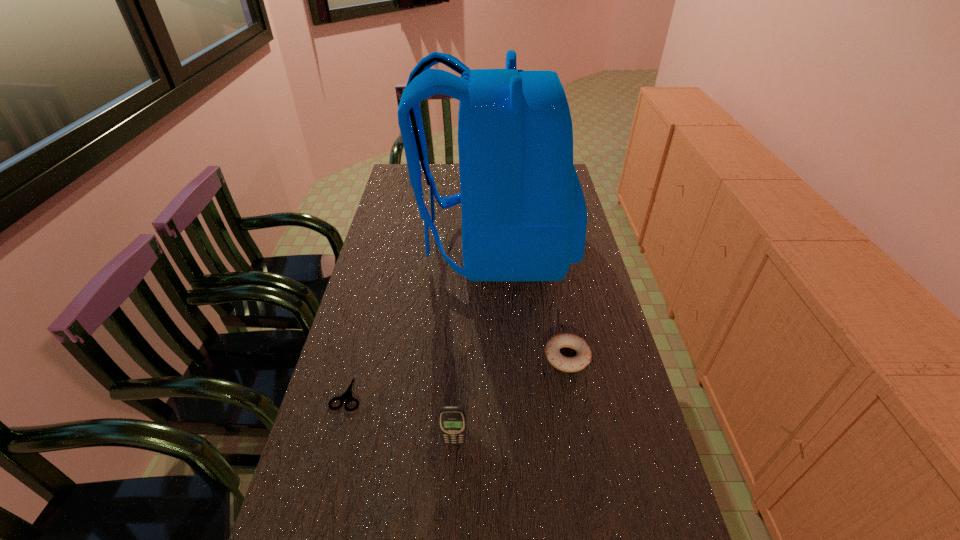
You are a GUI agent. You are given a task and a screenshot of the screen. Output one action in this format:
    pyautogui.click(x=<x>, y=<y>)
    Task: Click on the vacant area that lies between the tallest object and the third tallest object
    This screenshot has height=540, width=960.
    Given the screenshot: What is the action you would take?
    pyautogui.click(x=531, y=302)

Locate an element on the screen. This screenshot has height=540, width=960. free space between the nearest object and the tallest object is located at coordinates (474, 345).

At what (x,y) coordinates should I click in order to perform the action: click on free space that is in between the cellular telephone and the tallest object. Please return your answer as a coordinate pair (x, y). The image size is (960, 540). Looking at the image, I should click on (474, 345).

Identify the location of vacant space that's between the doughnut and the cellular telephone. This screenshot has width=960, height=540. (511, 400).

Where is `free area in between the cellular telephone and the shears`? Image resolution: width=960 pixels, height=540 pixels. free area in between the cellular telephone and the shears is located at coordinates (401, 418).

This screenshot has height=540, width=960. What are the coordinates of `vacant space in between the shortest object and the backpack` in the screenshot? It's located at (421, 320).

This screenshot has height=540, width=960. I want to click on free space between the shears and the third tallest object, so click(x=457, y=375).

The width and height of the screenshot is (960, 540). Find the location of `vacant space that is in between the farthest object and the third tallest object`. vacant space that is in between the farthest object and the third tallest object is located at coordinates (531, 302).

You are a GUI agent. You are given a task and a screenshot of the screen. Output one action in this format:
    pyautogui.click(x=<x>, y=<y>)
    Task: Click on the object that is the closest one to the doughnut
    The image size is (960, 540).
    Given the screenshot: What is the action you would take?
    pyautogui.click(x=524, y=216)

I want to click on the second closest object relative to the second shortest object, so click(x=452, y=419).